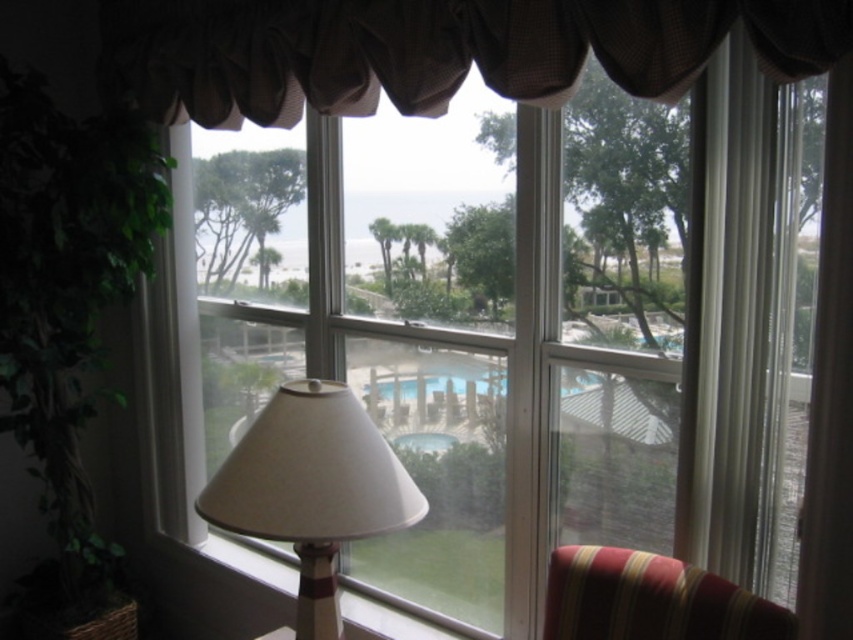
Question: Which point is closer to the camera?

Choices:
 (A) (366, 396)
 (B) (215, 497)
 (C) (561, 561)
 (D) (256, 97)

Answer: (B)

Question: Which object is closer to the camera taking this photo?

Choices:
 (A) white matte lampshade at lower left
 (B) brown textured valance at upper center
 (C) striped fabric armchair at lower right
 (D) transparent glass pool at center

Answer: (B)

Question: Is brown textured valance at upper center thinner than transparent glass pool at center?

Choices:
 (A) no
 (B) yes

Answer: (A)

Question: Does brown textured valance at upper center have a lesser width compared to transparent glass pool at center?

Choices:
 (A) yes
 (B) no

Answer: (B)

Question: Which object appears closest to the camera in this image?

Choices:
 (A) striped fabric armchair at lower right
 (B) white matte lampshade at lower left
 (C) brown textured valance at upper center
 (D) transparent glass pool at center

Answer: (C)

Question: Is striped fabric armchair at lower right positioned in front of transparent glass pool at center?

Choices:
 (A) no
 (B) yes

Answer: (B)